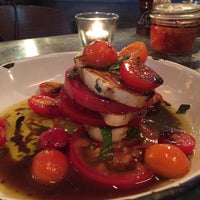
At what (x,y) coordinates should I click in order to perform the action: click on white bowl. Please return your answer as a coordinate pair (x, y). Looking at the image, I should click on (31, 76).